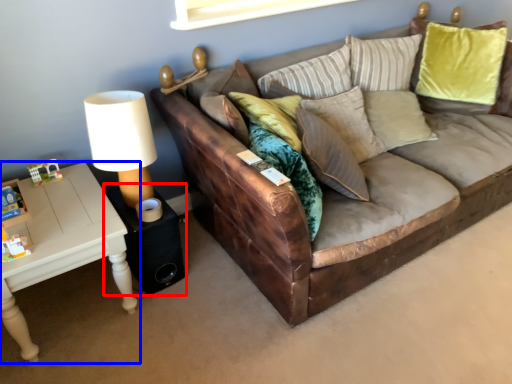
Question: Which point is further to the camera, side table (highlighted by a red box) or table (highlighted by a blue box)?

Choices:
 (A) side table
 (B) table

Answer: (A)